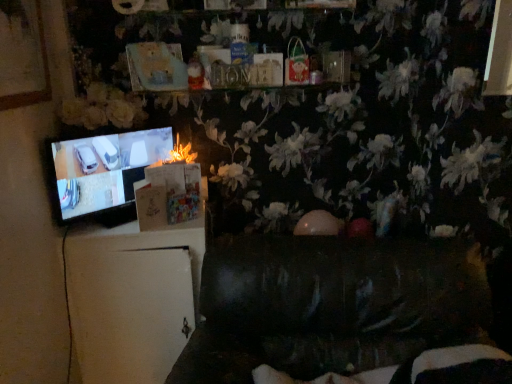
Question: Is black glossy television at left smaller than fluffy paper at center?

Choices:
 (A) no
 (B) yes

Answer: (A)

Question: Could you tell me if black glossy television at left is facing fluffy paper at center?

Choices:
 (A) no
 (B) yes

Answer: (B)

Question: Does black glossy television at left have a lesser width compared to fluffy paper at center?

Choices:
 (A) yes
 (B) no

Answer: (A)

Question: Is black glossy television at left shorter than fluffy paper at center?

Choices:
 (A) no
 (B) yes

Answer: (A)

Question: From a real-world perspective, is black glossy television at left on top of fluffy paper at center?

Choices:
 (A) no
 (B) yes

Answer: (A)

Question: Is black glossy television at left at the left side of fluffy paper at center?

Choices:
 (A) no
 (B) yes

Answer: (B)

Question: From a real-world perspective, is dark leather couch at lower center on fluffy paper at center?

Choices:
 (A) yes
 (B) no

Answer: (B)

Question: Is dark leather couch at lower center positioned behind fluffy paper at center?

Choices:
 (A) yes
 (B) no

Answer: (B)

Question: Considering the relative positions of dark leather couch at lower center and fluffy paper at center in the image provided, is dark leather couch at lower center in front of fluffy paper at center?

Choices:
 (A) no
 (B) yes

Answer: (B)

Question: Considering the relative positions of dark leather couch at lower center and fluffy paper at center in the image provided, is dark leather couch at lower center to the right of fluffy paper at center from the viewer's perspective?

Choices:
 (A) no
 (B) yes

Answer: (B)

Question: Is dark leather couch at lower center looking in the opposite direction of fluffy paper at center?

Choices:
 (A) no
 (B) yes

Answer: (A)

Question: Is dark leather couch at lower center smaller than fluffy paper at center?

Choices:
 (A) no
 (B) yes

Answer: (A)

Question: Considering the relative sizes of fluffy paper at center and dark leather couch at lower center in the image provided, is fluffy paper at center bigger than dark leather couch at lower center?

Choices:
 (A) yes
 (B) no

Answer: (B)